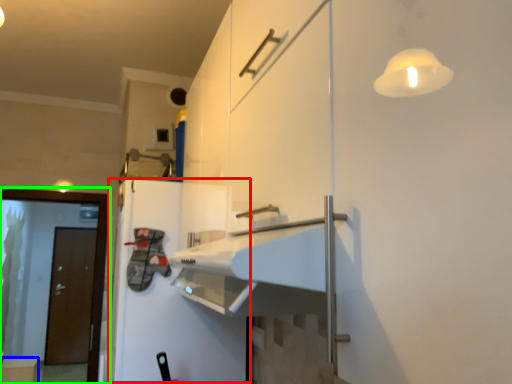
Question: Which object is positioned closest to wide (highlighted by a red box)? Select from cabinetry (highlighted by a blue box) and screen door (highlighted by a green box).

Choices:
 (A) cabinetry
 (B) screen door

Answer: (B)